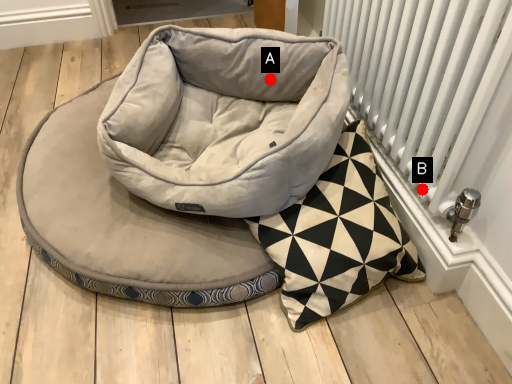
Question: Two points are circled on the image, labeled by A and B beside each circle. Which of the following is the closest to the observer?

Choices:
 (A) A is closer
 (B) B is closer

Answer: (B)